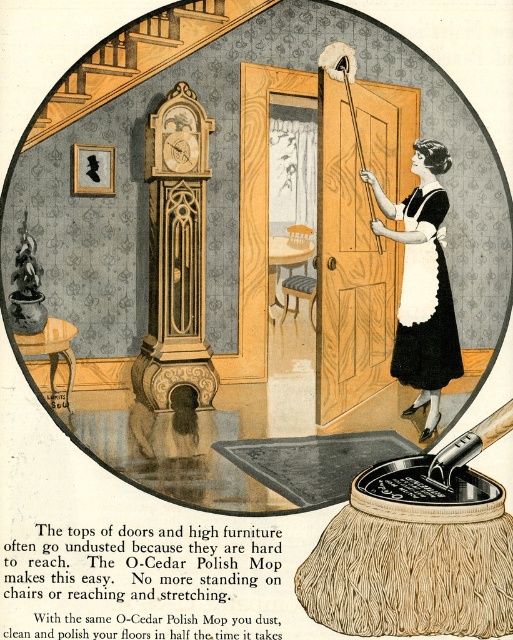
Does black cotton apron at upper right lie in front of white cotton apron at right?

Yes, black cotton apron at upper right is in front of white cotton apron at right.

Looking at this image, measure the distance from black cotton apron at upper right to white cotton apron at right.

A distance of 2.85 inches exists between black cotton apron at upper right and white cotton apron at right.

Is point (413, 356) positioned in front of point (441, 192)?

No, (413, 356) is further to viewer.

This screenshot has width=513, height=640. What are the coordinates of `black cotton apron at upper right` in the screenshot? It's located at (424, 284).

Between point (424, 326) and point (426, 365), which one is positioned behind?

Positioned behind is point (426, 365).

Which is more to the left, black cotton apron at upper right or white cotton apron at center?

black cotton apron at upper right is more to the left.

Is point (437, 269) farther from viewer compared to point (426, 358)?

No.

This screenshot has height=640, width=513. I want to click on black cotton apron at upper right, so point(424,284).

Is wooden carved clock at center smaller than white cotton apron at right?

No, wooden carved clock at center is not smaller than white cotton apron at right.

Does wooden carved clock at center have a greater height compared to white cotton apron at right?

Indeed, wooden carved clock at center has a greater height compared to white cotton apron at right.

The height and width of the screenshot is (640, 513). Identify the location of wooden carved clock at center. (175, 256).

This screenshot has height=640, width=513. What are the coordinates of `wooden carved clock at center` in the screenshot? It's located at (175, 256).